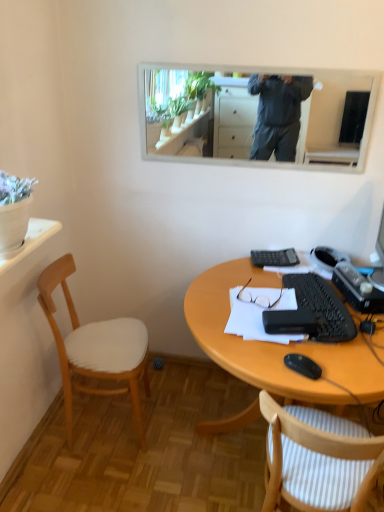
Where is `free space to the left of black plastic keyboard at center right`? Image resolution: width=384 pixels, height=512 pixels. free space to the left of black plastic keyboard at center right is located at coordinates (217, 308).